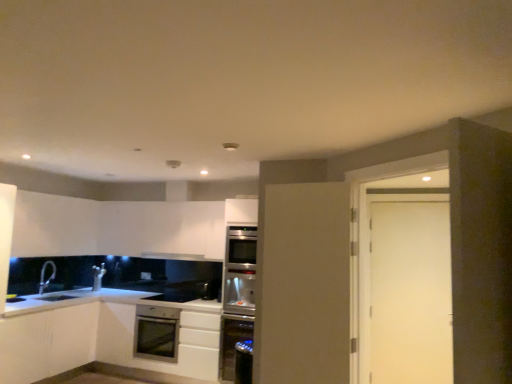
Question: Does satin silver oven at lower center come behind satin silver oven at center?

Choices:
 (A) yes
 (B) no

Answer: (A)

Question: From a real-world perspective, is satin silver oven at lower center located beneath satin silver oven at center?

Choices:
 (A) yes
 (B) no

Answer: (A)

Question: Is satin silver oven at lower center positioned with its back to satin silver oven at center?

Choices:
 (A) yes
 (B) no

Answer: (B)

Question: Can you confirm if satin silver oven at lower center is thinner than satin silver oven at center?

Choices:
 (A) no
 (B) yes

Answer: (A)

Question: Is satin silver oven at lower center not inside satin silver oven at center?

Choices:
 (A) yes
 (B) no

Answer: (A)

Question: In the image, is satin silver exhaust hood at upper center positioned in front of or behind silver metallic faucet at lower left?

Choices:
 (A) front
 (B) behind

Answer: (B)

Question: Would you say satin silver exhaust hood at upper center is inside or outside silver metallic faucet at lower left?

Choices:
 (A) outside
 (B) inside

Answer: (A)

Question: In terms of size, does satin silver exhaust hood at upper center appear bigger or smaller than silver metallic faucet at lower left?

Choices:
 (A) small
 (B) big

Answer: (B)

Question: From a real-world perspective, relative to silver metallic faucet at lower left, is satin silver exhaust hood at upper center vertically above or below?

Choices:
 (A) above
 (B) below

Answer: (A)

Question: Considering the positions of point (134, 324) and point (152, 344), is point (134, 324) closer or farther from the camera than point (152, 344)?

Choices:
 (A) farther
 (B) closer

Answer: (A)

Question: Looking at the image, does satin white cabinet at lower center, the second cabinetry viewed from the left, seem bigger or smaller compared to satin silver oven at lower center?

Choices:
 (A) small
 (B) big

Answer: (B)

Question: Relative to satin silver oven at lower center, is satin white cabinet at lower center, marked as the first cabinetry in a right-to-left arrangement, in front or behind?

Choices:
 (A) behind
 (B) front

Answer: (B)

Question: From a real-world perspective, is satin white cabinet at lower center, the second cabinetry viewed from the left, positioned above or below satin silver oven at lower center?

Choices:
 (A) below
 (B) above

Answer: (A)

Question: Is satin silver microwave at lower center to the left or to the right of satin stainless steel dishwasher at center in the image?

Choices:
 (A) left
 (B) right

Answer: (A)

Question: Would you say satin silver microwave at lower center is inside or outside satin stainless steel dishwasher at center?

Choices:
 (A) outside
 (B) inside

Answer: (A)